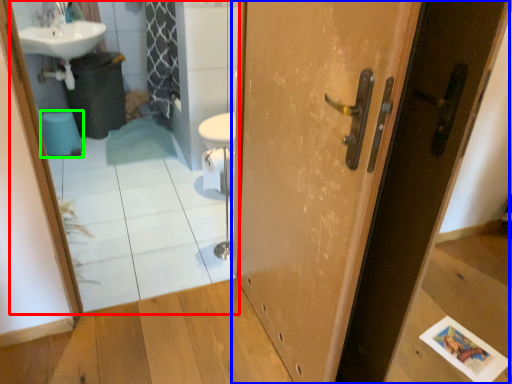
Question: Estimate the real-world distances between objects in this image. Which object is farther from mirror (highlighted by a red box), door (highlighted by a blue box) or toilet bowl (highlighted by a green box)?

Choices:
 (A) door
 (B) toilet bowl

Answer: (A)